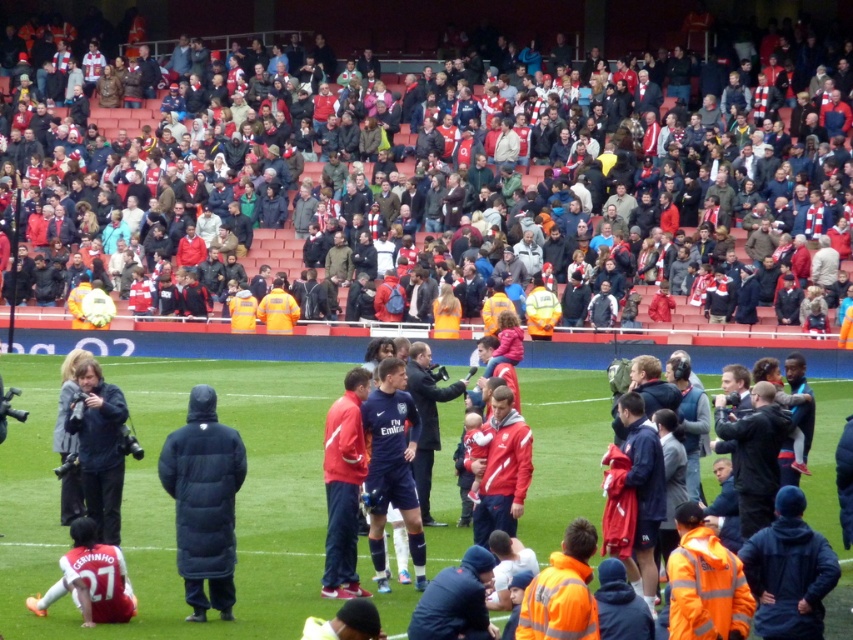
Question: Does dark gray puffer jacket at lower left have a smaller size compared to white jersey at lower left?

Choices:
 (A) yes
 (B) no

Answer: (B)

Question: Is red fabric scarf at upper center further to camera compared to white jersey at lower left?

Choices:
 (A) yes
 (B) no

Answer: (A)

Question: Estimate the real-world distances between objects in this image. Which object is farther from the dark blue puffer jacket at center?

Choices:
 (A) white jersey at lower left
 (B) dark gray puffer jacket at lower left

Answer: (B)

Question: Where is dark gray puffer jacket at lower left located in relation to white jersey at lower left in the image?

Choices:
 (A) above
 (B) below

Answer: (A)

Question: Which object is the farthest from the dark gray puffer jacket at lower left?

Choices:
 (A) red fabric scarf at upper center
 (B) white jersey at lower left

Answer: (A)

Question: Which point is farther to the camera?

Choices:
 (A) (428, 3)
 (B) (106, 481)
 (C) (82, 616)

Answer: (A)